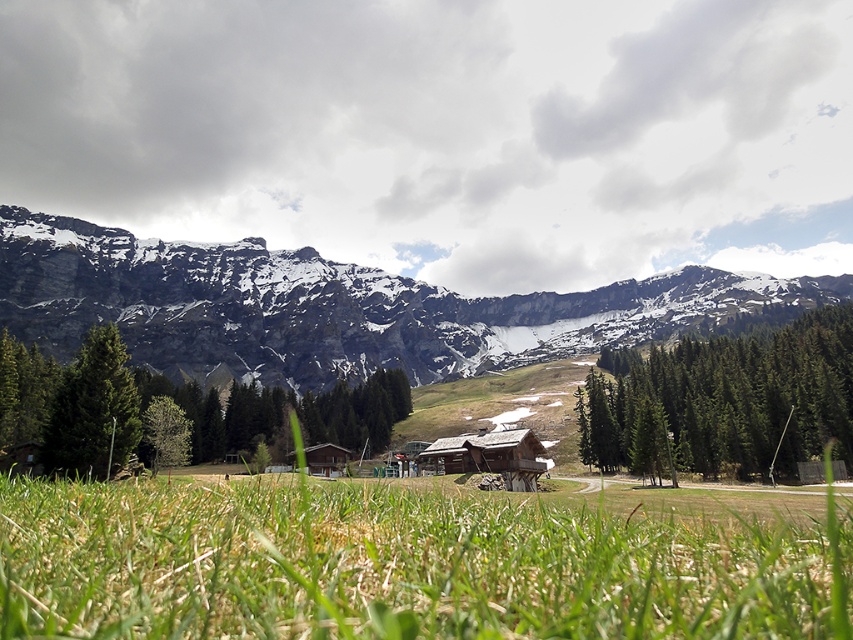
In the scene shown: You are standing at the point marked as point (685, 608) and want to walk to the point marked as point (614, 310). Which direction should you move to get closer to your destination?

You should move away from the camera because point (614, 310) is further from the camera than point (685, 608).

You are standing in the mountain landscape and want to place a small flag at the point closer to you between point (442, 557) and point (805, 336). Which point should you choose?

You should place the flag at point (442, 557) because it is closer to the viewer than point (805, 336).